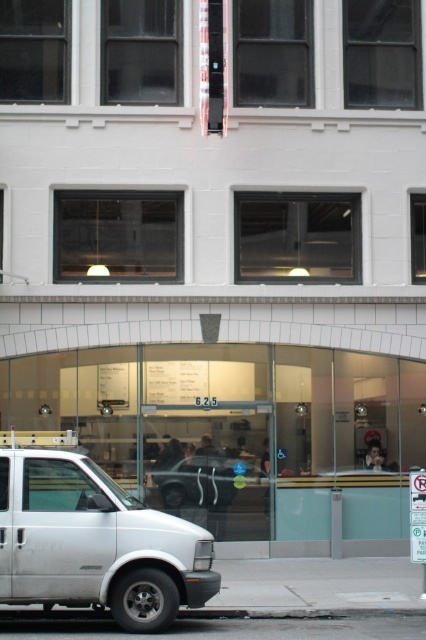
You are a delivery driver who needs to park your vehicle in the parking lot behind the building. The parking space available is only 5 meters long. You have a white matte van at lower left and a metallic silver car at center. Which vehicle can fit into the parking space?

The white matte van at lower left has a larger size compared to metallic silver car at center. Since the parking space is 5 meters long, the metallic silver car at center can fit into the parking space, but the white matte van at lower left may be too large to fit.

You are a delivery person trying to park your 3.5 meter long truck between the white matte van at lower left and the metallic silver car at center. Can you fit your truck between them without overlapping either vehicle?

The distance between the white matte van at lower left and the metallic silver car at center is 5.81 meters. Since your truck is 3.5 meters long, there is enough space to park between them without overlapping.